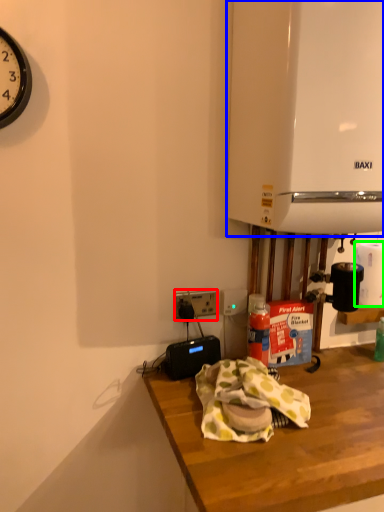
Question: Which object is positioned farthest from power outlet (highlighted by a red box)? Select from appliance (highlighted by a blue box) and paper towel (highlighted by a green box).

Choices:
 (A) appliance
 (B) paper towel

Answer: (A)